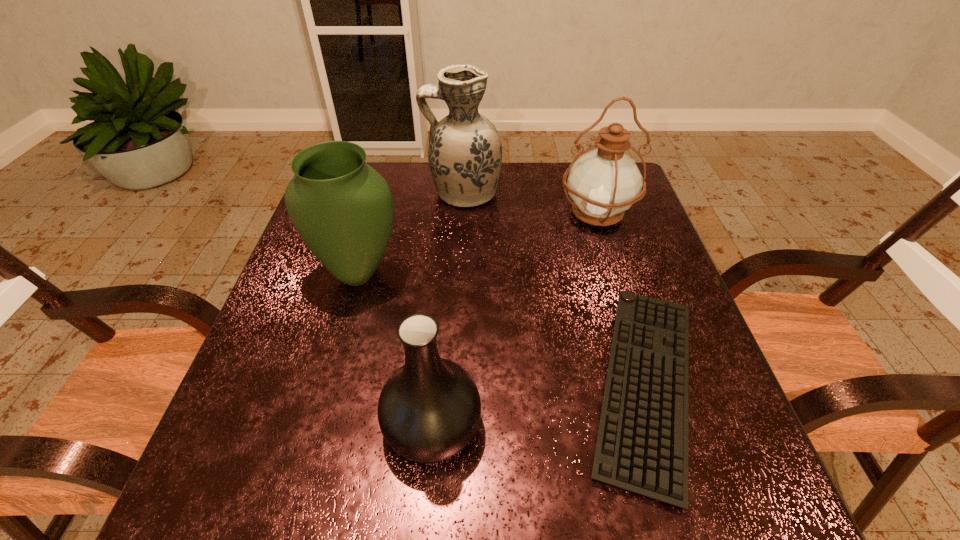
Identify the location of object at the far right corner. The width and height of the screenshot is (960, 540). (603, 183).

You are a GUI agent. You are given a task and a screenshot of the screen. Output one action in this format:
    pyautogui.click(x=<x>, y=<y>)
    Task: Click on the object that is positioned at the near right corner
    This screenshot has width=960, height=540.
    Given the screenshot: What is the action you would take?
    (x=642, y=444)

Identify the location of free space at the far edge of the desktop. The height and width of the screenshot is (540, 960). (503, 170).

Locate an element on the screen. free space at the near edge is located at coordinates [x=509, y=478].

Where is `vacant space at the left edge of the desktop`? vacant space at the left edge of the desktop is located at coordinates (275, 330).

Locate an element on the screen. This screenshot has height=540, width=960. free space at the right edge of the desktop is located at coordinates point(724,427).

The image size is (960, 540). In order to click on vacant position at the far right corner of the desktop in this screenshot , I will do `click(639, 205)`.

In order to click on free space between the nearest vase and the oil lamp in this screenshot , I will do `click(515, 319)`.

Image resolution: width=960 pixels, height=540 pixels. I want to click on free space between the nearest vase and the farthest vase, so click(447, 309).

Where is `free spot between the shortest object and the nearest vase`? The height and width of the screenshot is (540, 960). free spot between the shortest object and the nearest vase is located at coordinates (539, 404).